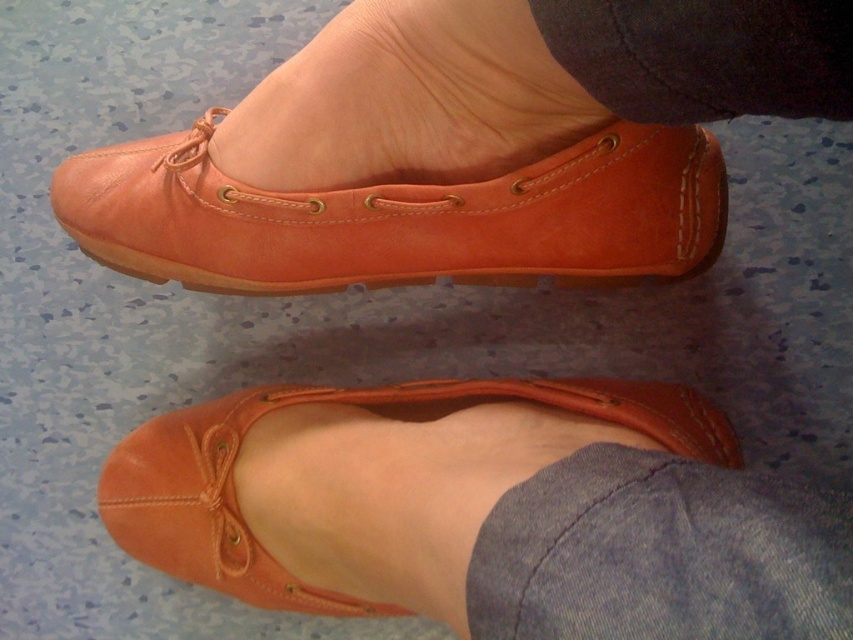
Question: Which object appears farthest from the camera in this image?

Choices:
 (A) matte leather shoe at upper center
 (B) matte leather shoe at center

Answer: (B)

Question: Can you confirm if matte leather shoe at upper center is positioned to the right of matte leather shoe at center?

Choices:
 (A) no
 (B) yes

Answer: (A)

Question: Among these objects, which one is nearest to the camera?

Choices:
 (A) matte leather shoe at center
 (B) matte leather shoe at upper center

Answer: (B)

Question: Does matte leather shoe at upper center have a lesser width compared to matte leather shoe at center?

Choices:
 (A) yes
 (B) no

Answer: (B)

Question: Is matte leather shoe at upper center further to camera compared to matte leather shoe at center?

Choices:
 (A) no
 (B) yes

Answer: (A)